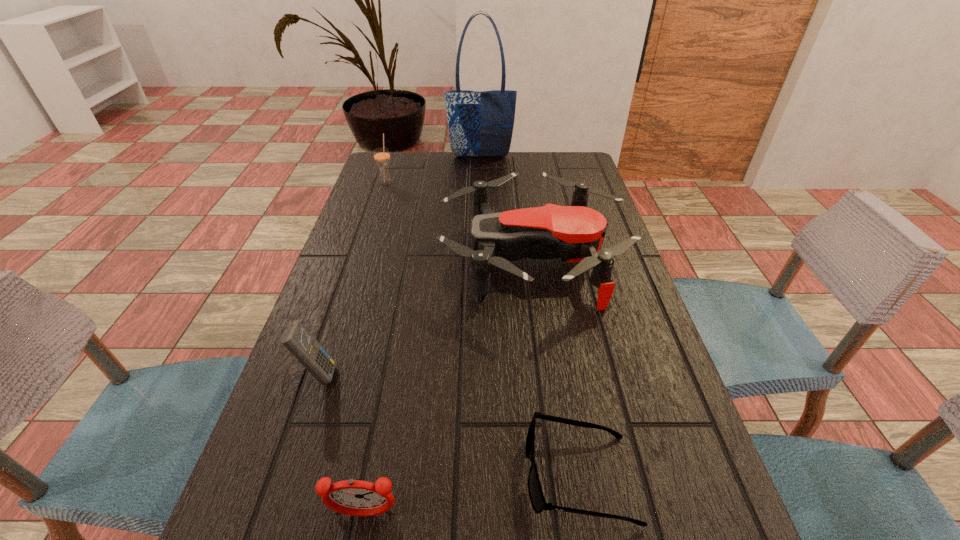
Where is `free space that satisfies the following two spatial constraints: 1. on the front-facing side of the sunglasses; 2. on the front-facing side of the alarm clock`? free space that satisfies the following two spatial constraints: 1. on the front-facing side of the sunglasses; 2. on the front-facing side of the alarm clock is located at coordinates pos(586,515).